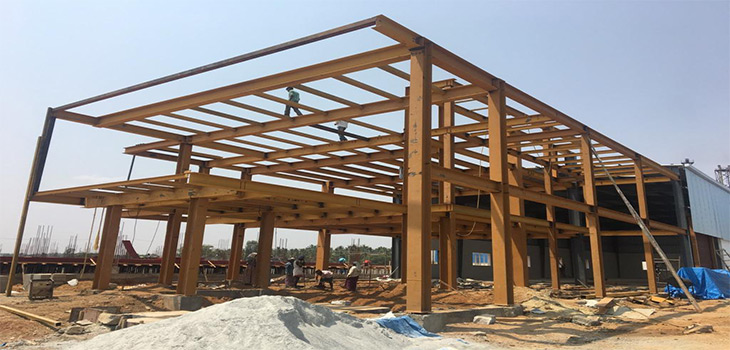
This screenshot has width=730, height=350. Identify the location of ladders. (685, 285), (726, 255).